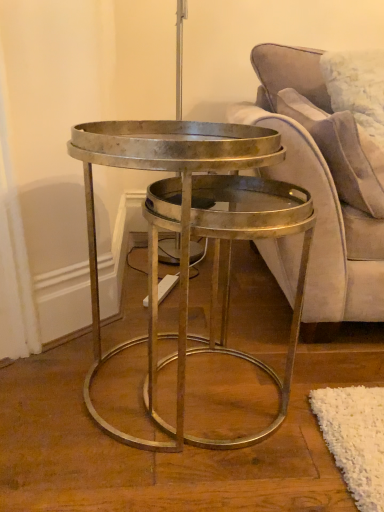
Question: Does suede-like beige pillow at upper right have a larger size compared to velvet purple couch at right?

Choices:
 (A) yes
 (B) no

Answer: (B)

Question: From the image's perspective, is suede-like beige pillow at upper right on velvet purple couch at right?

Choices:
 (A) yes
 (B) no

Answer: (A)

Question: Considering the relative positions of suede-like beige pillow at upper right and velvet purple couch at right in the image provided, is suede-like beige pillow at upper right to the left of velvet purple couch at right from the viewer's perspective?

Choices:
 (A) yes
 (B) no

Answer: (A)

Question: Is suede-like beige pillow at upper right shorter than velvet purple couch at right?

Choices:
 (A) yes
 (B) no

Answer: (A)

Question: Is suede-like beige pillow at upper right positioned behind velvet purple couch at right?

Choices:
 (A) yes
 (B) no

Answer: (A)

Question: Is suede-like beige pillow at upper right directly adjacent to velvet purple couch at right?

Choices:
 (A) no
 (B) yes

Answer: (B)

Question: From a real-world perspective, is velvet purple couch at right on suede-like beige pillow at upper right?

Choices:
 (A) no
 (B) yes

Answer: (A)

Question: From the image's perspective, is velvet purple couch at right over suede-like beige pillow at upper right?

Choices:
 (A) yes
 (B) no

Answer: (B)

Question: Is suede-like beige pillow at upper right located within velvet purple couch at right?

Choices:
 (A) yes
 (B) no

Answer: (A)

Question: Is velvet purple couch at right facing towards suede-like beige pillow at upper right?

Choices:
 (A) no
 (B) yes

Answer: (B)

Question: Does velvet purple couch at right appear on the right side of suede-like beige pillow at upper right?

Choices:
 (A) yes
 (B) no

Answer: (A)

Question: From the image's perspective, is velvet purple couch at right below suede-like beige pillow at upper right?

Choices:
 (A) no
 (B) yes

Answer: (B)

Question: Is suede-like beige pillow at upper right inside metallic/golden coffee table at center?

Choices:
 (A) no
 (B) yes

Answer: (A)